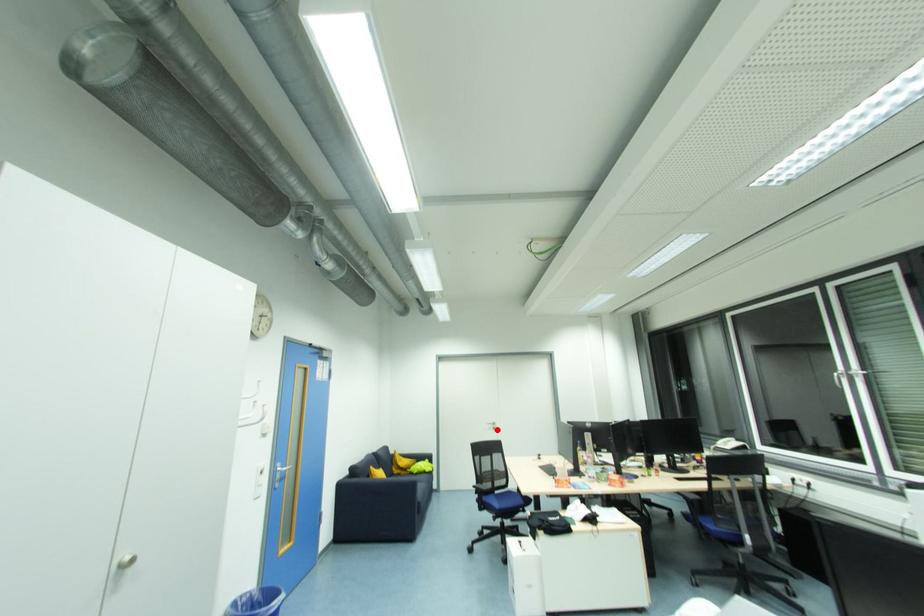
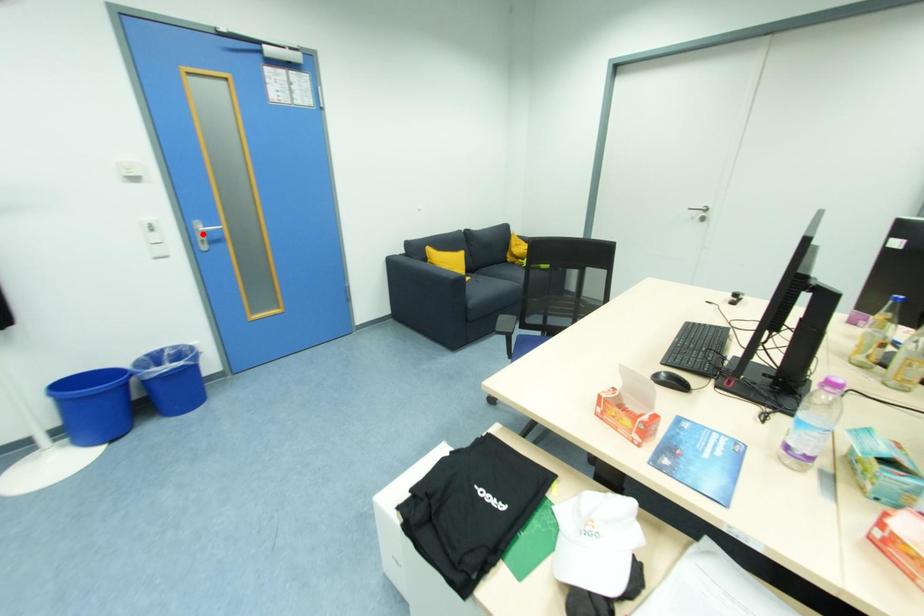
From the picture: I am providing you with two images of the same scene from different viewpoints. A red point is marked on the first image and another point is marked on the second image. Is the red point in image1 aligned with the point shown in image2?

No